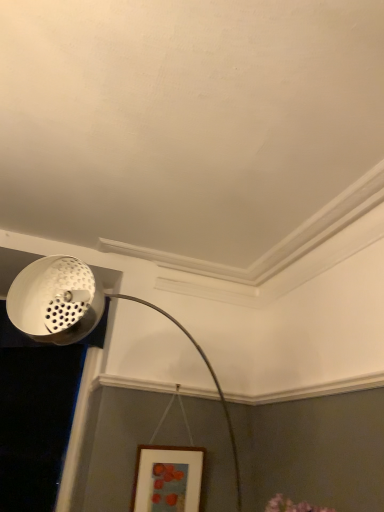
The height and width of the screenshot is (512, 384). What do you see at coordinates (167, 479) in the screenshot?
I see `wooden picture frame at lower center` at bounding box center [167, 479].

Where is `white perforated metal at upper left`? This screenshot has height=512, width=384. white perforated metal at upper left is located at coordinates (56, 300).

The height and width of the screenshot is (512, 384). What do you see at coordinates (56, 300) in the screenshot? I see `white perforated metal at upper left` at bounding box center [56, 300].

Identify the location of wooden picture frame at lower center. The image size is (384, 512). tap(167, 479).

Considering the relative sizes of white perforated metal at upper left and white perforated lampshade at upper left in the image provided, is white perforated metal at upper left bigger than white perforated lampshade at upper left?

No, white perforated metal at upper left is not bigger than white perforated lampshade at upper left.

Can you confirm if white perforated metal at upper left is taller than white perforated lampshade at upper left?

No.

From the image's perspective, who appears lower, white perforated metal at upper left or white perforated lampshade at upper left?

white perforated lampshade at upper left is shown below in the image.

What's the angular difference between white perforated metal at upper left and white perforated lampshade at upper left's facing directions?

The facing directions of white perforated metal at upper left and white perforated lampshade at upper left are 48.2 degrees apart.

Considering the sizes of wooden picture frame at lower center and white perforated metal at upper left in the image, is wooden picture frame at lower center taller or shorter than white perforated metal at upper left?

Considering their sizes, wooden picture frame at lower center has less height than white perforated metal at upper left.

Considering the sizes of objects wooden picture frame at lower center and white perforated metal at upper left in the image provided, who is smaller, wooden picture frame at lower center or white perforated metal at upper left?

With smaller size is wooden picture frame at lower center.

From the picture: Is wooden picture frame at lower center facing towards white perforated metal at upper left?

No, wooden picture frame at lower center does not turn towards white perforated metal at upper left.

Is white perforated lampshade at upper left positioned far away from wooden picture frame at lower center?

Yes, white perforated lampshade at upper left and wooden picture frame at lower center are located far from each other.

Looking at the image, does white perforated lampshade at upper left seem bigger or smaller compared to wooden picture frame at lower center?

Considering their sizes, white perforated lampshade at upper left takes up more space than wooden picture frame at lower center.

Considering their positions, is white perforated lampshade at upper left located in front of or behind wooden picture frame at lower center?

In the image, white perforated lampshade at upper left appears in front of wooden picture frame at lower center.

How much distance is there between white perforated lampshade at upper left and white perforated metal at upper left?

white perforated lampshade at upper left is 0.87 inches away from white perforated metal at upper left.

Between white perforated lampshade at upper left and white perforated metal at upper left, which one has larger width?

white perforated lampshade at upper left is wider.

Where is `lamp on the right of white perforated metal at upper left`? This screenshot has height=512, width=384. lamp on the right of white perforated metal at upper left is located at coordinates (78, 313).

Which of these two, white perforated lampshade at upper left or white perforated metal at upper left, stands shorter?

Standing shorter between the two is white perforated metal at upper left.

Considering the sizes of white perforated metal at upper left and wooden picture frame at lower center in the image, is white perforated metal at upper left bigger or smaller than wooden picture frame at lower center?

white perforated metal at upper left is bigger than wooden picture frame at lower center.

How different are the orientations of white perforated metal at upper left and wooden picture frame at lower center in degrees?

43.8 degrees.

From a real-world perspective, which is physically above, white perforated metal at upper left or wooden picture frame at lower center?

In real-world perspective, white perforated metal at upper left is above.

Between white perforated metal at upper left and wooden picture frame at lower center, which one has larger width?

white perforated metal at upper left.

Is wooden picture frame at lower center positioned far away from white perforated lampshade at upper left?

Yes, wooden picture frame at lower center is far from white perforated lampshade at upper left.

How far apart are wooden picture frame at lower center and white perforated lampshade at upper left?

wooden picture frame at lower center and white perforated lampshade at upper left are 4.17 feet apart.

Looking at this image, which is behind, wooden picture frame at lower center or white perforated lampshade at upper left?

wooden picture frame at lower center is more distant.

From the picture: From a real-world perspective, is wooden picture frame at lower center on white perforated lampshade at upper left?

Actually, wooden picture frame at lower center is physically below white perforated lampshade at upper left in the real world.

Find the location of `lamp below the white perforated metal at upper left (from a real-world perspective)`. lamp below the white perforated metal at upper left (from a real-world perspective) is located at coordinates (78, 313).

Locate an element on the screen. light fixture lying above the wooden picture frame at lower center (from the image's perspective) is located at coordinates (56, 300).

Looking at this image, which object lies nearer to the anchor point wooden picture frame at lower center, white perforated metal at upper left or white perforated lampshade at upper left?

white perforated lampshade at upper left lies closer to wooden picture frame at lower center than the other object.

When comparing their distances from white perforated lampshade at upper left, does white perforated metal at upper left or wooden picture frame at lower center seem further?

wooden picture frame at lower center lies further to white perforated lampshade at upper left than the other object.

Which object lies further to the anchor point white perforated metal at upper left, white perforated lampshade at upper left or wooden picture frame at lower center?

Among the two, wooden picture frame at lower center is located further to white perforated metal at upper left.

Considering their positions, is white perforated lampshade at upper left positioned further to wooden picture frame at lower center than white perforated metal at upper left?

white perforated metal at upper left is further to wooden picture frame at lower center.

Considering their positions, is wooden picture frame at lower center positioned further to white perforated lampshade at upper left than white perforated metal at upper left?

wooden picture frame at lower center is positioned further to the anchor white perforated lampshade at upper left.

From the image, which object appears to be farther from white perforated metal at upper left, wooden picture frame at lower center or white perforated lampshade at upper left?

The object further to white perforated metal at upper left is wooden picture frame at lower center.

Locate an element on the screen. picture frame between white perforated lampshade at upper left and white perforated metal at upper left in the front-back direction is located at coordinates click(x=167, y=479).